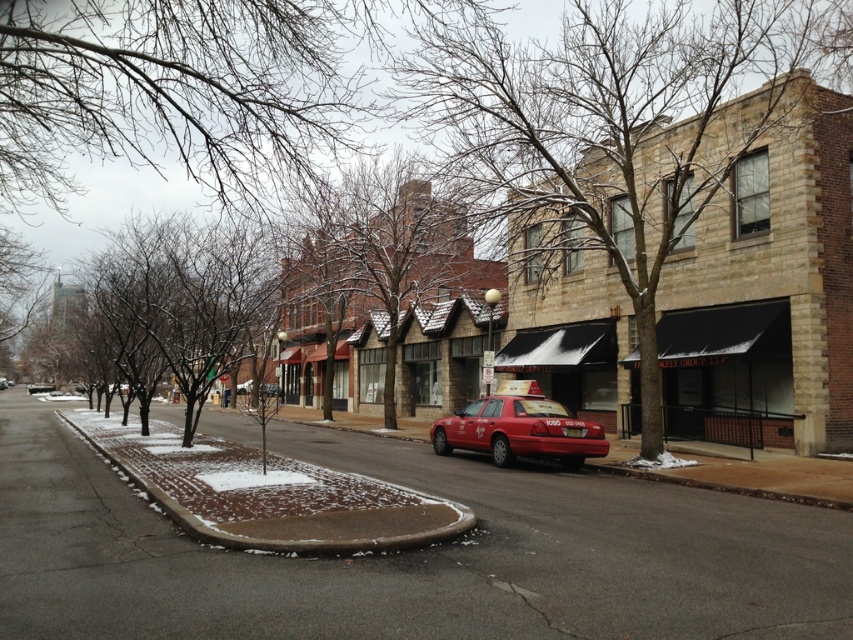
Question: Is shiny red taxi at center above metallic silver taxi at center?

Choices:
 (A) yes
 (B) no

Answer: (A)

Question: Is shiny red taxi at center to the right of metallic silver taxi at center from the viewer's perspective?

Choices:
 (A) yes
 (B) no

Answer: (A)

Question: Which of the following is the closest to the observer?

Choices:
 (A) (38, 387)
 (B) (512, 381)
 (C) (0, 387)

Answer: (B)

Question: Which object appears farthest from the camera in this image?

Choices:
 (A) metallic silver taxi at center
 (B) shiny red taxi at center

Answer: (A)

Question: Is the position of shiny red taxi at center more distant than that of metallic silver taxi at center?

Choices:
 (A) no
 (B) yes

Answer: (A)

Question: Which of the following is the farthest from the observer?

Choices:
 (A) red matte taxi at center
 (B) shiny red taxi at center

Answer: (A)